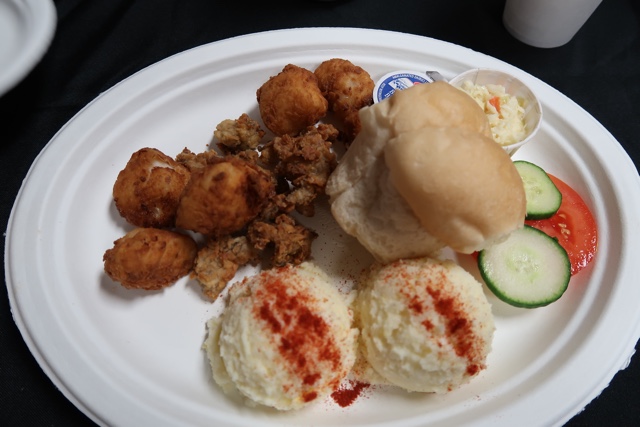
Locate an element on the screen. edge of plate is located at coordinates (56, 138), (24, 68).